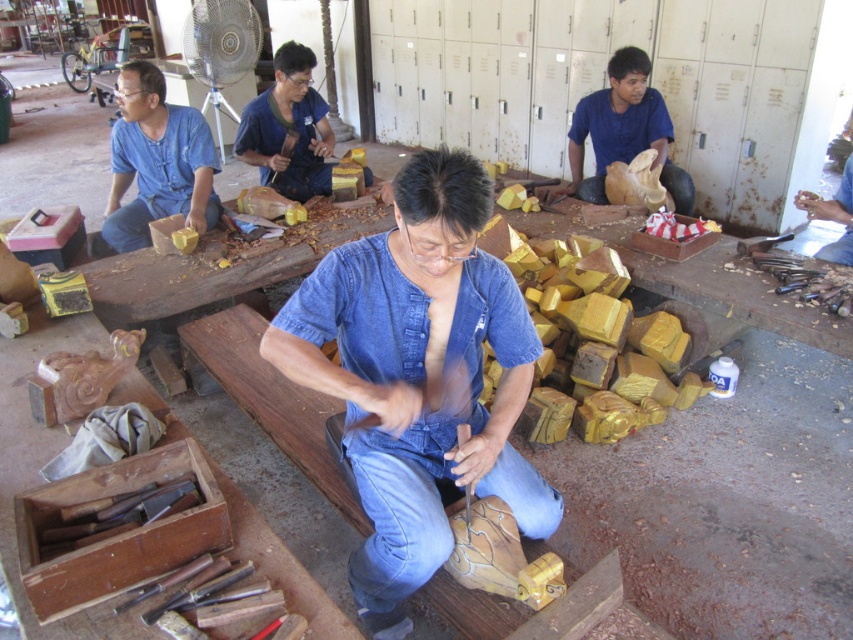
Can you confirm if blue denim jeans at center is positioned to the left of denim jeans at center?

Incorrect, blue denim jeans at center is not on the left side of denim jeans at center.

Who is positioned more to the right, blue denim jeans at center or denim jeans at center?

blue denim jeans at center

Describe the element at coordinates (395, 524) in the screenshot. The image size is (853, 640). I see `blue denim jeans at center` at that location.

In order to click on blue denim jeans at center in this screenshot , I will do `click(395, 524)`.

Is denim shirt at center shorter than denim jeans at center?

No, denim shirt at center is not shorter than denim jeans at center.

Is denim shirt at center smaller than denim jeans at center?

Incorrect, denim shirt at center is not smaller in size than denim jeans at center.

Between point (410, 385) and point (136, 198), which one is positioned behind?

Point (136, 198)

Image resolution: width=853 pixels, height=640 pixels. Find the location of `denim shirt at center`. denim shirt at center is located at coordinates (418, 376).

Between point (439, 161) and point (392, 500), which one is positioned in front?

Point (439, 161)

Which is behind, point (399, 280) or point (367, 584)?

Positioned behind is point (367, 584).

The width and height of the screenshot is (853, 640). Identify the location of denim shirt at center. (418, 376).